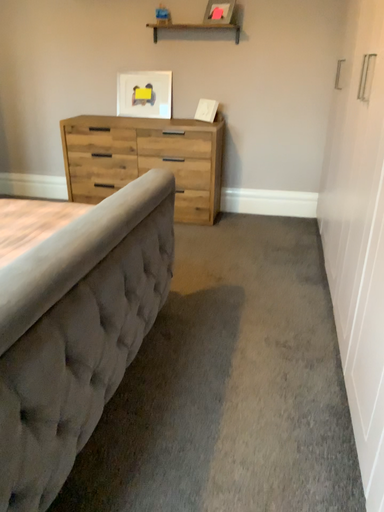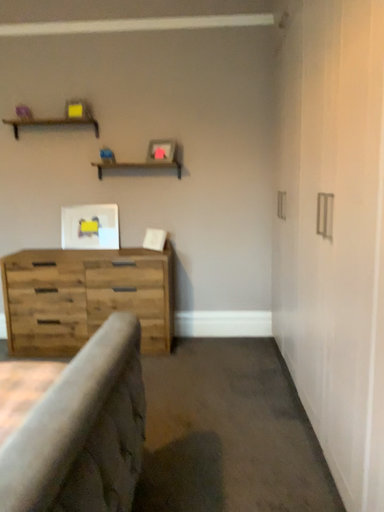
Question: Which way did the camera rotate in the video?

Choices:
 (A) rotated downward
 (B) rotated upward

Answer: (B)